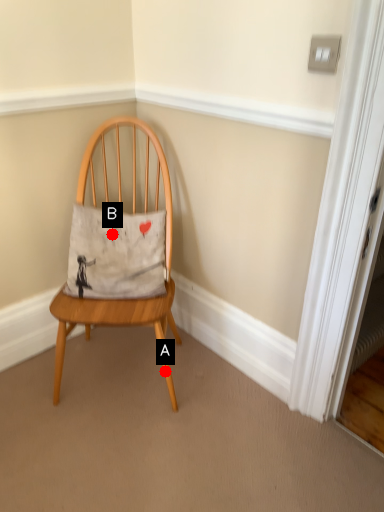
Question: Two points are circled on the image, labeled by A and B beside each circle. Which point appears farthest from the camera in this image?

Choices:
 (A) A is further
 (B) B is further

Answer: (B)